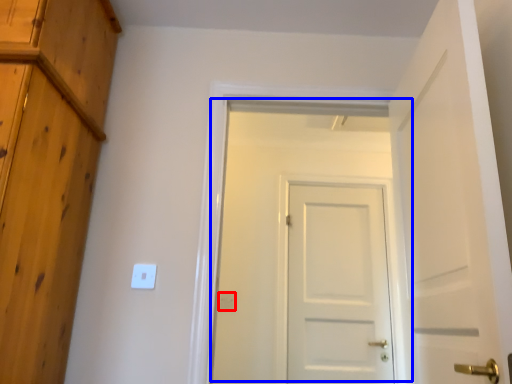
Question: Among these objects, which one is farthest to the camera, electric outlet (highlighted by a red box) or door (highlighted by a blue box)?

Choices:
 (A) electric outlet
 (B) door

Answer: (A)